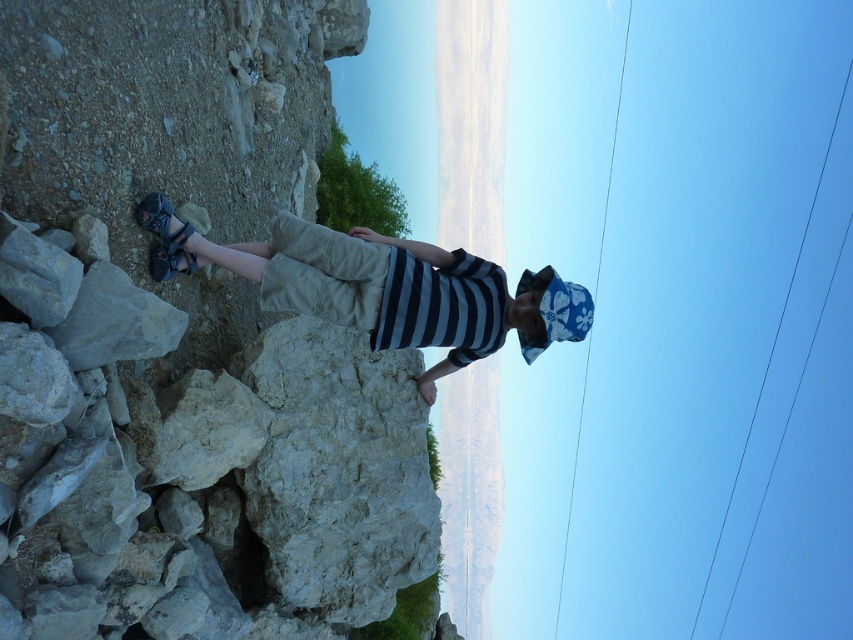
You are a hiker who wants to climb the rough stone cliff at left but need to ensure your khaki cotton shorts at center won

The rough stone cliff at left is larger in size than the khaki cotton shorts at center, so the cliff is big enough for you to climb while wearing the shorts.

You are a hiker assessing the terrain. You notice the rough stone cliff at left and the khaki cotton shorts at center. Which object is taller?

The rough stone cliff at left is taller than the khaki cotton shorts at center.